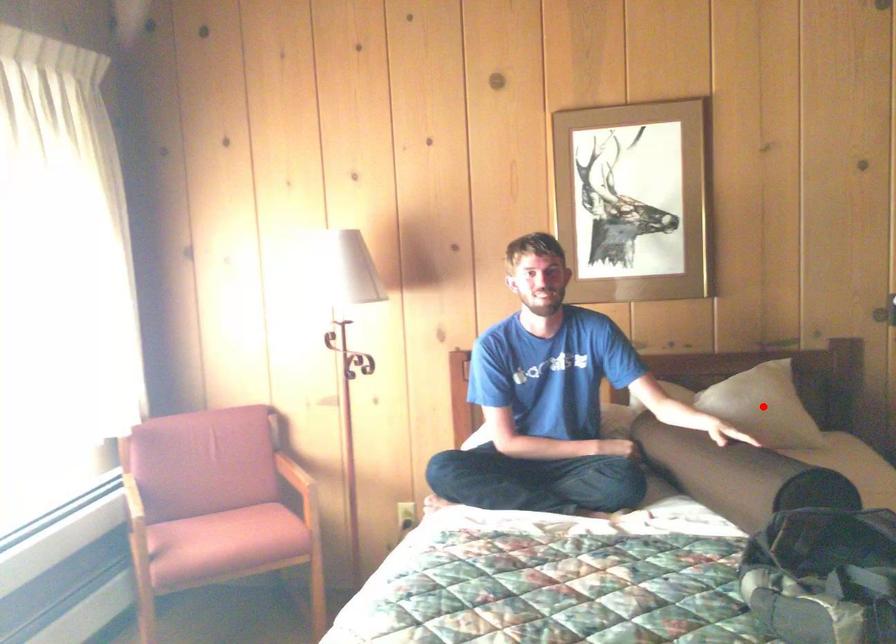
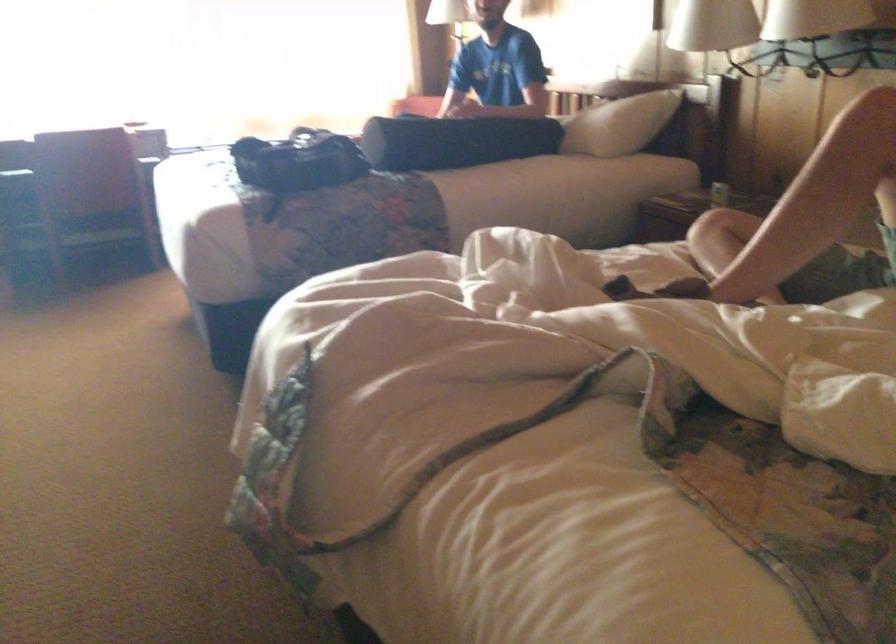
Question: I am providing you with two images of the same scene from different viewpoints. A red point is marked on the first image. Can you still see the location of the red point in image 2?

Choices:
 (A) Yes
 (B) No

Answer: (B)